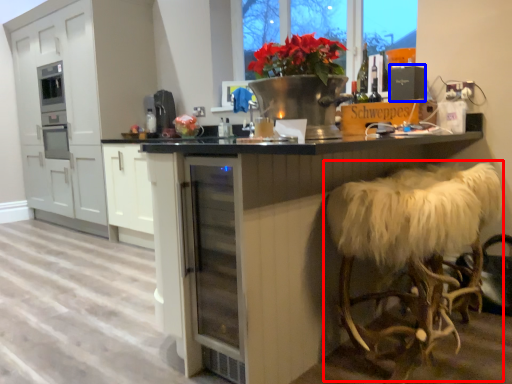
Question: Which object appears farthest to the camera in this image, swivel chair (highlighted by a red box) or appliance (highlighted by a blue box)?

Choices:
 (A) swivel chair
 (B) appliance

Answer: (B)